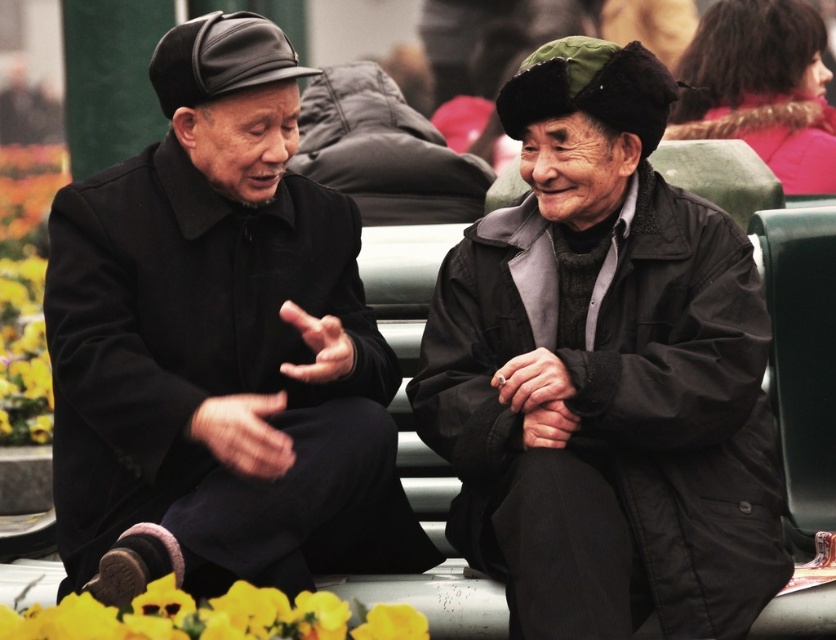
You are a photographer trying to capture a candid shot of the two subjects in the scene. The camera you are using has a limited focus range. You want to ensure both the dark gray woolen jacket at center and the velvet pink coat at upper right are in focus. Based on their positions, which object is closer to the camera, requiring you to adjust the focus accordingly?

The dark gray woolen jacket at center is to the left of the velvet pink coat at upper right, so it is closer to the camera. Adjust focus to ensure both are in sharp focus by setting the focal point on the dark gray woolen jacket at center first.

You are an observer standing in front of the scene. You notice the matte black coat at left and the velvet pink coat at upper right. Which one is positioned higher in the image?

The velvet pink coat at upper right is positioned higher than the matte black coat at left.